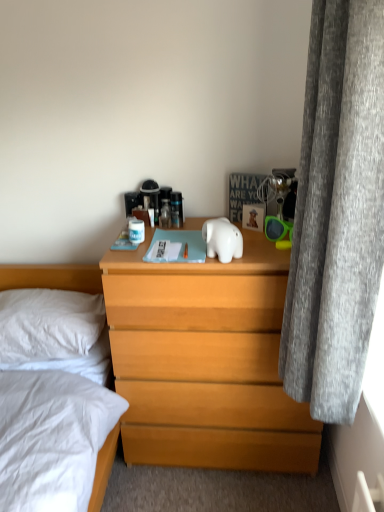
Question: Does white soft pillow at left have a larger size compared to clear plastic bottle at center?

Choices:
 (A) no
 (B) yes

Answer: (B)

Question: Is white soft pillow at left in contact with clear plastic bottle at center?

Choices:
 (A) yes
 (B) no

Answer: (B)

Question: From the image's perspective, does white soft pillow at left appear lower than clear plastic bottle at center?

Choices:
 (A) yes
 (B) no

Answer: (A)

Question: Can you confirm if white soft pillow at left is wider than clear plastic bottle at center?

Choices:
 (A) no
 (B) yes

Answer: (B)

Question: Does white soft pillow at left come in front of clear plastic bottle at center?

Choices:
 (A) yes
 (B) no

Answer: (A)

Question: Does white soft pillow at left have a lesser height compared to clear plastic bottle at center?

Choices:
 (A) no
 (B) yes

Answer: (A)

Question: Is white glossy elephant at center not inside light brown wooden chest of drawers at center?

Choices:
 (A) no
 (B) yes

Answer: (B)

Question: Can you confirm if white glossy elephant at center is bigger than light brown wooden chest of drawers at center?

Choices:
 (A) no
 (B) yes

Answer: (A)

Question: Is white glossy elephant at center closer to the viewer compared to light brown wooden chest of drawers at center?

Choices:
 (A) no
 (B) yes

Answer: (B)

Question: Can light brown wooden chest of drawers at center be found inside white glossy elephant at center?

Choices:
 (A) yes
 (B) no

Answer: (B)

Question: Considering the relative sizes of white glossy elephant at center and light brown wooden chest of drawers at center in the image provided, is white glossy elephant at center smaller than light brown wooden chest of drawers at center?

Choices:
 (A) yes
 (B) no

Answer: (A)

Question: Considering the relative positions of white glossy elephant at center and light brown wooden chest of drawers at center in the image provided, is white glossy elephant at center to the left of light brown wooden chest of drawers at center from the viewer's perspective?

Choices:
 (A) yes
 (B) no

Answer: (A)

Question: Is white glossy elephant at center completely or partially inside clear plastic bottle at center?

Choices:
 (A) no
 (B) yes

Answer: (A)